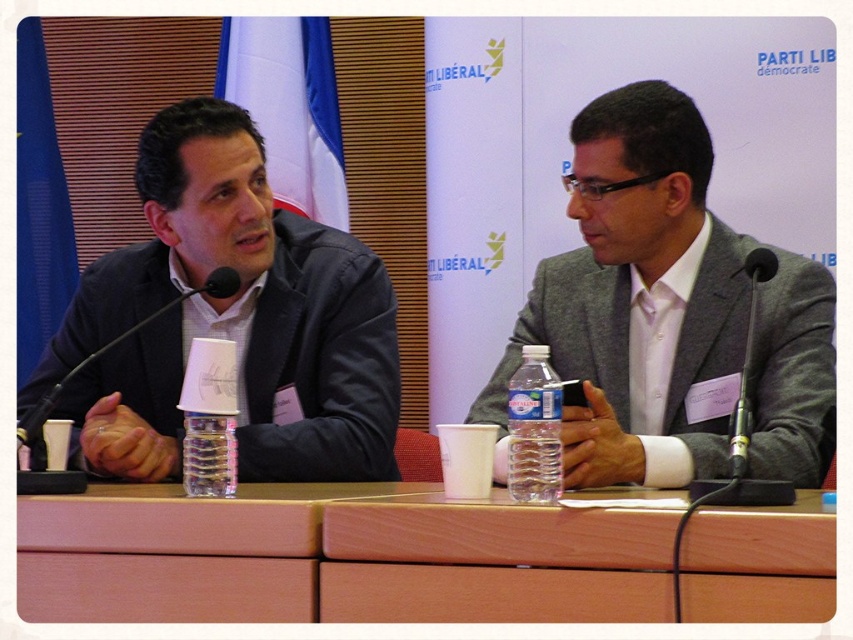
Where is the wooden table at center located in the image?

The wooden table at center is located at point (x=338, y=557).